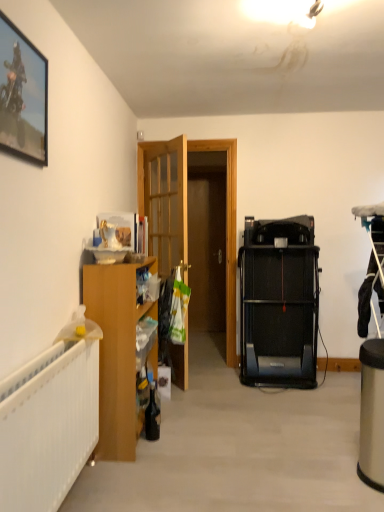
Question: Considering the positions of black plastic treadmill at center-right and wooden cabinet at left in the image, is black plastic treadmill at center-right wider or thinner than wooden cabinet at left?

Choices:
 (A) wide
 (B) thin

Answer: (A)

Question: Is black plastic treadmill at center-right inside the boundaries of wooden cabinet at left, or outside?

Choices:
 (A) inside
 (B) outside

Answer: (B)

Question: Which object is the farthest from the wooden cabinet at left?

Choices:
 (A) black plastic treadmill at center-right
 (B) metallic framed picture at upper left
 (C) wooden door at center

Answer: (A)

Question: Which object is positioned closest to the wooden door at center?

Choices:
 (A) wooden cabinet at left
 (B) metallic framed picture at upper left
 (C) black plastic treadmill at center-right

Answer: (C)